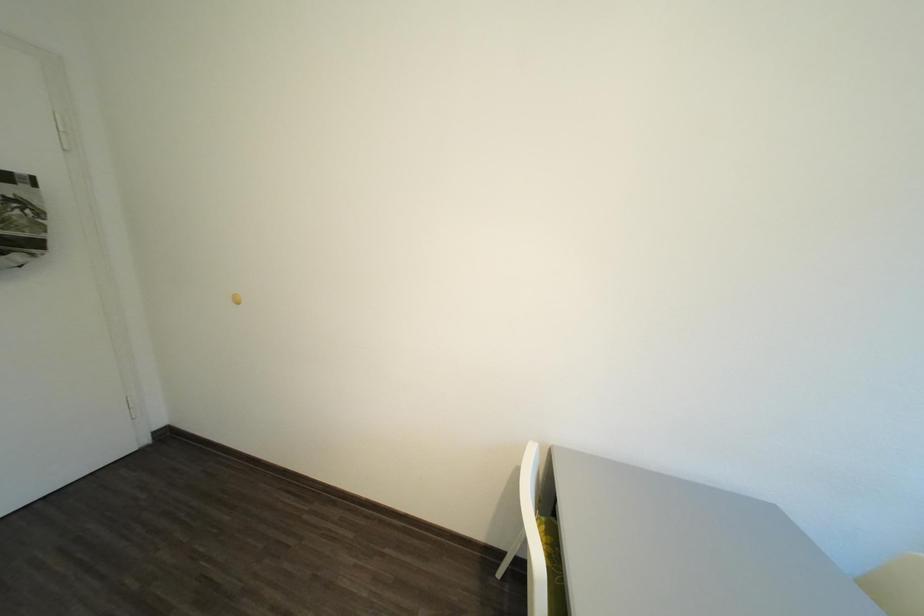
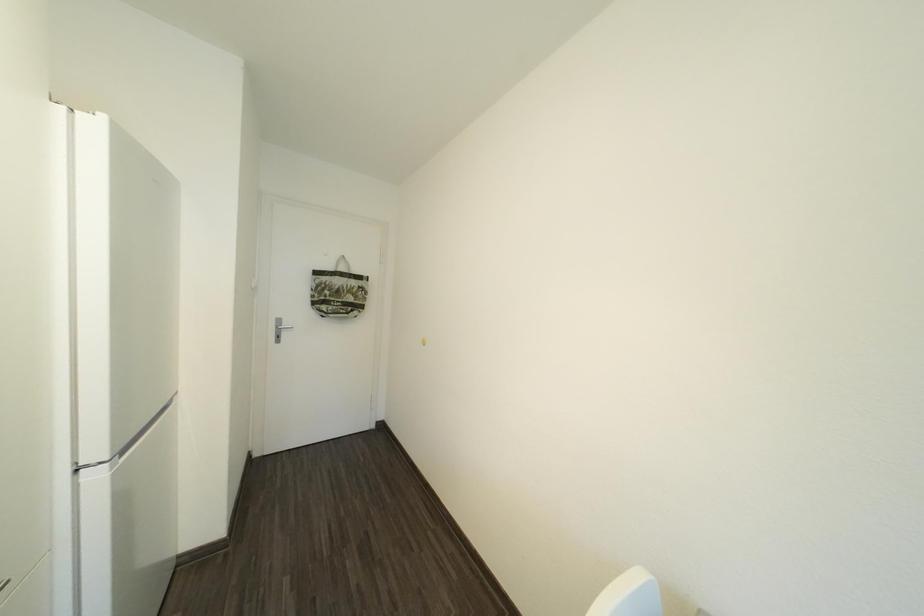
Question: The images are taken continuously from a first-person perspective. In which direction is your viewpoint rotating?

Choices:
 (A) Left
 (B) Right
 (C) Up
 (D) Down

Answer: (A)